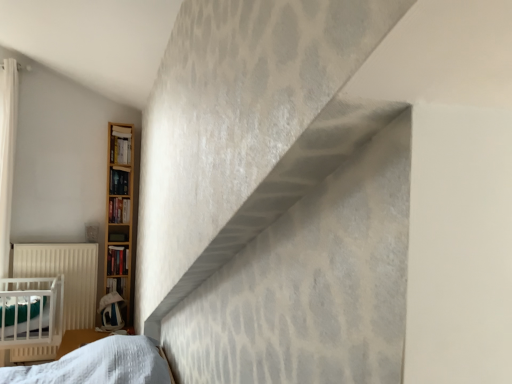
Question: Is the depth of wooden bookshelf at left, which appears as the first book when viewed from the top, less than that of hardcover book at left, which appears as the fourth book when viewed from the top?

Choices:
 (A) yes
 (B) no

Answer: (A)

Question: From the image's perspective, is wooden bookshelf at left, the fifth book when ordered from bottom to top, under hardcover book at left, which appears as the fourth book when viewed from the top?

Choices:
 (A) yes
 (B) no

Answer: (B)

Question: Can you confirm if wooden bookshelf at left, which appears as the first book when viewed from the top, is wider than hardcover book at left, which appears as the fourth book when viewed from the top?

Choices:
 (A) yes
 (B) no

Answer: (A)

Question: Considering the relative sizes of wooden bookshelf at left, which appears as the first book when viewed from the top, and hardcover book at left, which appears as the fourth book when viewed from the top, in the image provided, is wooden bookshelf at left, which appears as the first book when viewed from the top, taller than hardcover book at left, which appears as the fourth book when viewed from the top,?

Choices:
 (A) no
 (B) yes

Answer: (B)

Question: Can you confirm if wooden bookshelf at left, the fifth book when ordered from bottom to top, is positioned to the right of hardcover book at left, which appears as the fourth book when viewed from the top?

Choices:
 (A) no
 (B) yes

Answer: (B)

Question: Is wooden bookshelf at left, which appears as the first book when viewed from the top, positioned with its back to hardcover book at left, which appears as the second book when ordered from the bottom?

Choices:
 (A) yes
 (B) no

Answer: (B)

Question: Is wooden bookshelf at left, which appears as the first book when viewed from the top, facing towards hardcover book at left, the 3th book from the top?

Choices:
 (A) no
 (B) yes

Answer: (A)

Question: Can you confirm if wooden bookshelf at left, the fifth book when ordered from bottom to top, is positioned to the right of hardcover book at left, which ranks as the third book in bottom-to-top order?

Choices:
 (A) no
 (B) yes

Answer: (B)

Question: Does wooden bookshelf at left, which appears as the first book when viewed from the top, have a greater width compared to hardcover book at left, which ranks as the third book in bottom-to-top order?

Choices:
 (A) yes
 (B) no

Answer: (A)

Question: Can you see wooden bookshelf at left, which appears as the first book when viewed from the top, touching hardcover book at left, the 3th book from the top?

Choices:
 (A) no
 (B) yes

Answer: (A)

Question: Can you confirm if wooden bookshelf at left, which appears as the first book when viewed from the top, is smaller than hardcover book at left, which ranks as the third book in bottom-to-top order?

Choices:
 (A) yes
 (B) no

Answer: (B)

Question: Is wooden bookshelf at left, which appears as the first book when viewed from the top, not inside hardcover book at left, the 3th book from the top?

Choices:
 (A) no
 (B) yes

Answer: (B)

Question: Is hardcover book at left, the 3th book from the top, not close to wooden bookshelf at left, which appears as the first book when viewed from the top?

Choices:
 (A) yes
 (B) no

Answer: (B)